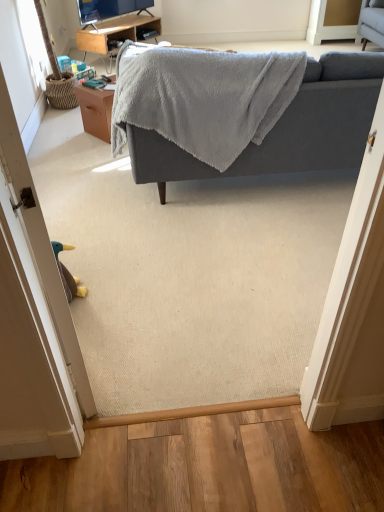
Question: From a real-world perspective, does brown fabric door at lower left stand above brown wood table at center?

Choices:
 (A) no
 (B) yes

Answer: (B)

Question: Is brown fabric door at lower left far from brown wood table at center?

Choices:
 (A) no
 (B) yes

Answer: (B)

Question: Does brown fabric door at lower left contain brown wood table at center?

Choices:
 (A) no
 (B) yes

Answer: (A)

Question: Considering the relative positions of brown fabric door at lower left and brown wood table at center in the image provided, is brown fabric door at lower left to the right of brown wood table at center from the viewer's perspective?

Choices:
 (A) no
 (B) yes

Answer: (B)

Question: Is brown fabric door at lower left oriented away from brown wood table at center?

Choices:
 (A) yes
 (B) no

Answer: (B)

Question: Is brown fabric door at lower left not within brown wood table at center?

Choices:
 (A) yes
 (B) no

Answer: (A)

Question: Is white glossy screen door at upper right at the left side of woodendesk at upper center?

Choices:
 (A) yes
 (B) no

Answer: (B)

Question: Is white glossy screen door at upper right shorter than woodendesk at upper center?

Choices:
 (A) no
 (B) yes

Answer: (A)

Question: From a real-world perspective, is white glossy screen door at upper right positioned under woodendesk at upper center based on gravity?

Choices:
 (A) yes
 (B) no

Answer: (B)

Question: Would you say woodendesk at upper center is part of white glossy screen door at upper right's contents?

Choices:
 (A) yes
 (B) no

Answer: (B)

Question: Is white glossy screen door at upper right thinner than woodendesk at upper center?

Choices:
 (A) yes
 (B) no

Answer: (A)

Question: Is white glossy screen door at upper right not within woodendesk at upper center?

Choices:
 (A) yes
 (B) no

Answer: (A)

Question: Is woodendesk at upper center thinner than brown fabric door at lower left?

Choices:
 (A) yes
 (B) no

Answer: (B)